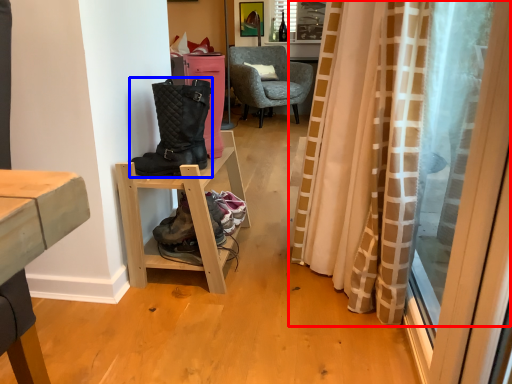
Question: Which object is further to the camera taking this photo, curtain (highlighted by a red box) or boots (highlighted by a blue box)?

Choices:
 (A) curtain
 (B) boots

Answer: (B)